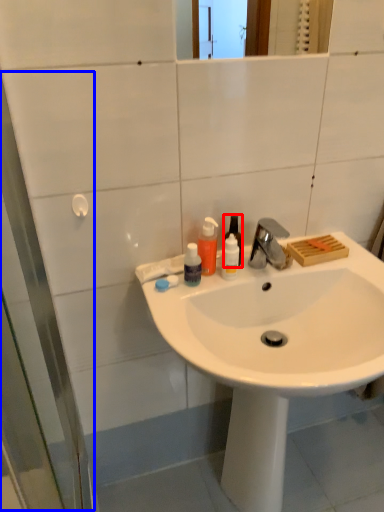
Question: Which of the following is the closest to the observer, bottle (highlighted by a red box) or screen door (highlighted by a blue box)?

Choices:
 (A) bottle
 (B) screen door

Answer: (B)